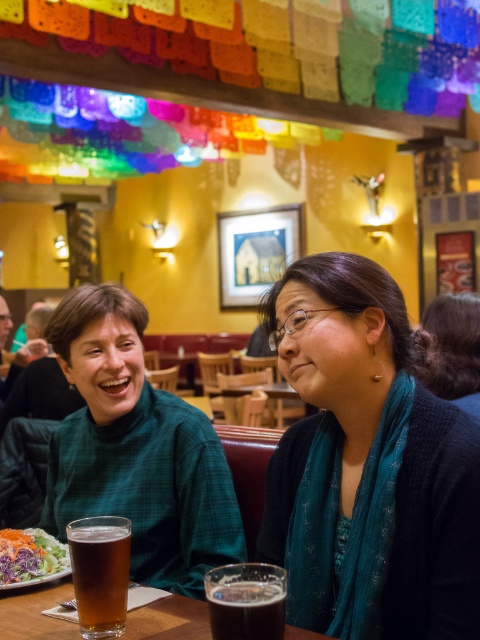
Does teal scarf at center come behind dark brown liquid at lower center?

Yes, teal scarf at center is behind dark brown liquid at lower center.

In the scene shown: Is the position of teal scarf at center less distant than that of dark brown liquid at lower center?

No.

Between point (376, 337) and point (273, 634), which one is positioned behind?

The point (376, 337) is behind.

At what (x,y) coordinates should I click in order to perform the action: click on teal scarf at center. Please return your answer as a coordinate pair (x, y). The image size is (480, 640). Looking at the image, I should click on (368, 465).

What do you see at coordinates (135, 449) in the screenshot?
I see `green plaid turtleneck sweater at center` at bounding box center [135, 449].

Can you confirm if green plaid turtleneck sweater at center is positioned to the left of translucent glass at lower left?

Indeed, green plaid turtleneck sweater at center is positioned on the left side of translucent glass at lower left.

Which is in front, point (115, 324) or point (80, 547)?

Point (80, 547) is in front.

Where is `green plaid turtleneck sweater at center`? green plaid turtleneck sweater at center is located at coordinates (135, 449).

Between dark brown liquid at lower center and fresh salad at lower left, which one has more height?

With more height is fresh salad at lower left.

Between dark brown liquid at lower center and fresh salad at lower left, which one is positioned lower?

fresh salad at lower left

Identify the location of dark brown liquid at lower center. Image resolution: width=480 pixels, height=640 pixels. pyautogui.click(x=247, y=611).

Locate an element on the screen. dark brown liquid at lower center is located at coordinates (247, 611).